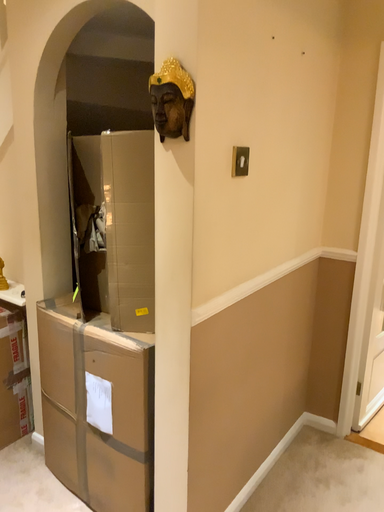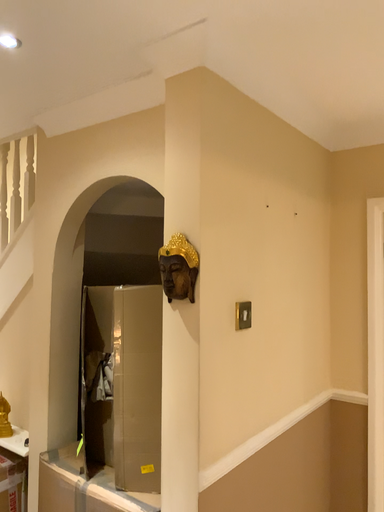
Question: Which way did the camera rotate in the video?

Choices:
 (A) rotated downward
 (B) rotated upward

Answer: (B)